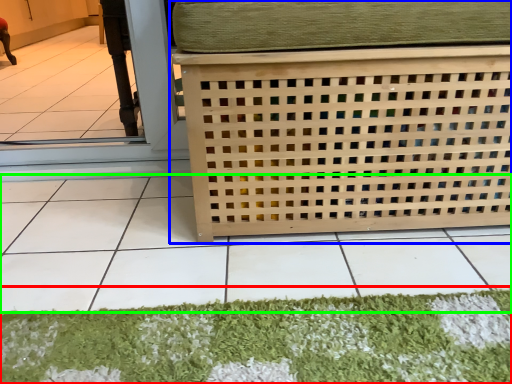
Question: Estimate the real-world distances between objects in this image. Which object is farther from mat (highlighted by a red box), furniture (highlighted by a blue box) or tile (highlighted by a green box)?

Choices:
 (A) furniture
 (B) tile

Answer: (A)